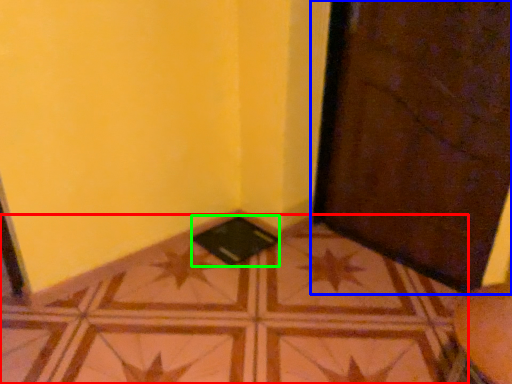
Question: Which object is positioned farthest from tile (highlighted by a red box)? Select from door (highlighted by a blue box) and pad (highlighted by a green box).

Choices:
 (A) door
 (B) pad

Answer: (A)